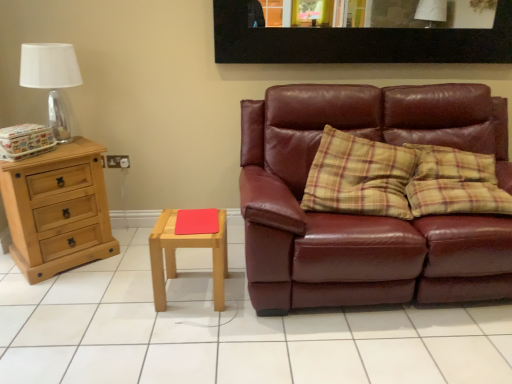
Question: From the image's perspective, is white tile at center positioned above or below light brown wooden stool at center?

Choices:
 (A) above
 (B) below

Answer: (B)

Question: Considering the positions of white tile at center and light brown wooden stool at center in the image, is white tile at center wider or thinner than light brown wooden stool at center?

Choices:
 (A) thin
 (B) wide

Answer: (B)

Question: Which is nearer to the transparent glass table lamp at upper left?

Choices:
 (A) light brown wooden stool at center
 (B) white tile at center
 (C) natural wood chest of drawers at left
 (D) black matte picture frame at upper center
 (E) matte leather couch at right

Answer: (C)

Question: Which object is positioned closest to the black matte picture frame at upper center?

Choices:
 (A) white tile at center
 (B) light brown wooden stool at center
 (C) natural wood chest of drawers at left
 (D) matte leather couch at right
 (E) transparent glass table lamp at upper left

Answer: (D)